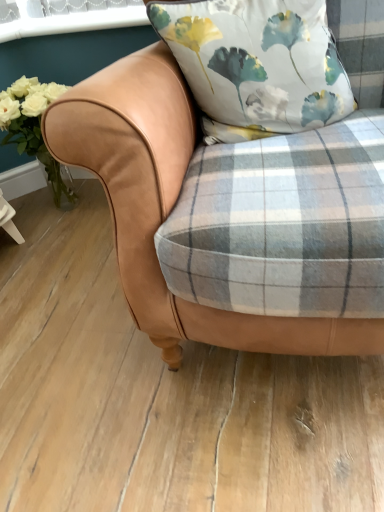
Question: Does tan leather chair at center appear on the left side of white plastic window screen at upper left?

Choices:
 (A) no
 (B) yes

Answer: (A)

Question: Are tan leather chair at center and white plastic window screen at upper left making contact?

Choices:
 (A) yes
 (B) no

Answer: (B)

Question: Is the position of tan leather chair at center less distant than that of white plastic window screen at upper left?

Choices:
 (A) no
 (B) yes

Answer: (B)

Question: From the image's perspective, is tan leather chair at center on white plastic window screen at upper left?

Choices:
 (A) yes
 (B) no

Answer: (B)

Question: Is tan leather chair at center located outside white plastic window screen at upper left?

Choices:
 (A) yes
 (B) no

Answer: (A)

Question: Is tan leather chair at center not close to white plastic window screen at upper left?

Choices:
 (A) no
 (B) yes

Answer: (A)

Question: Considering the relative sizes of silky floral pillow at center and tan leather chair at center in the image provided, is silky floral pillow at center smaller than tan leather chair at center?

Choices:
 (A) yes
 (B) no

Answer: (A)

Question: Is tan leather chair at center inside silky floral pillow at center?

Choices:
 (A) yes
 (B) no

Answer: (B)

Question: From the image's perspective, is silky floral pillow at center located beneath tan leather chair at center?

Choices:
 (A) no
 (B) yes

Answer: (A)

Question: From the image's perspective, is silky floral pillow at center on top of tan leather chair at center?

Choices:
 (A) no
 (B) yes

Answer: (B)

Question: Does silky floral pillow at center come behind tan leather chair at center?

Choices:
 (A) no
 (B) yes

Answer: (B)

Question: Considering the relative sizes of silky floral pillow at center and tan leather chair at center in the image provided, is silky floral pillow at center thinner than tan leather chair at center?

Choices:
 (A) yes
 (B) no

Answer: (A)

Question: Is the position of tan leather chair at center less distant than that of silky floral pillow at center?

Choices:
 (A) yes
 (B) no

Answer: (A)